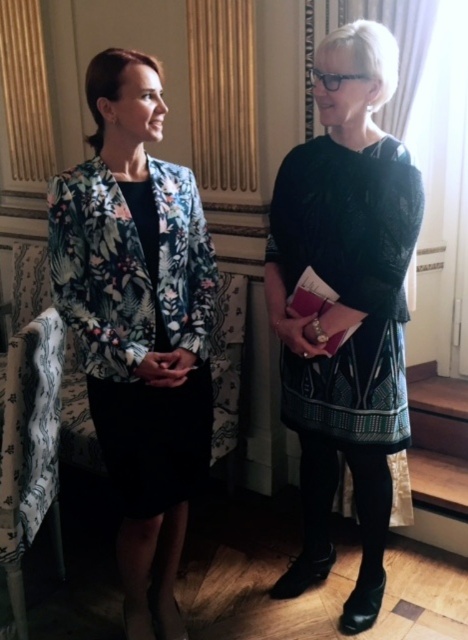
You are a photographer positioned in front of the scene. You want to take a photo focusing on the dark green textured dress at center without the patterned fabric armchair at lower left being visible in the background. Is this possible based on their positions?

The dark green textured dress at center is further to the viewer than the patterned fabric armchair at lower left, so yes, it is possible to focus on the dark green textured dress at center while keeping the patterned fabric armchair at lower left out of the background by adjusting the camera angle or zoom.